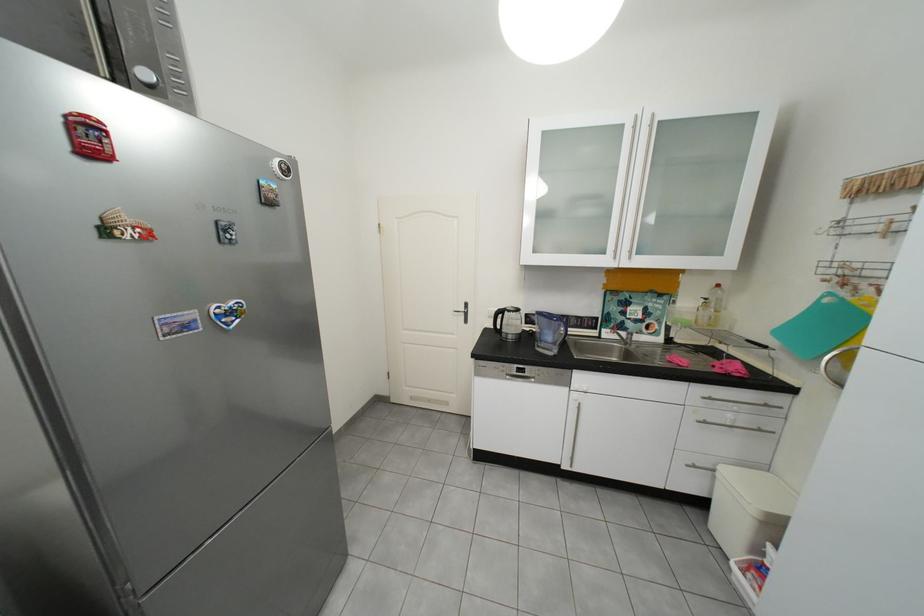
This screenshot has width=924, height=616. I want to click on red bus magnet, so click(89, 137).